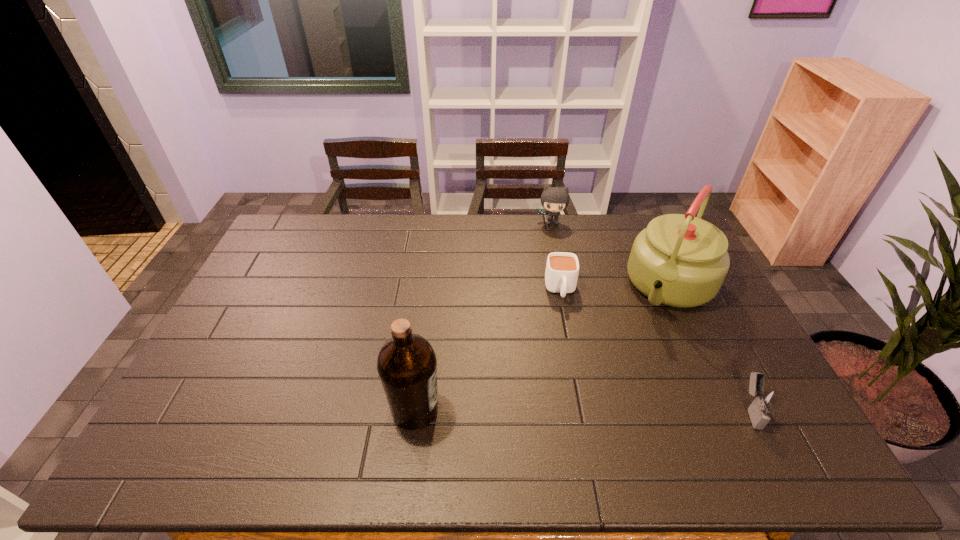
I want to click on vacant space situated on the side with the handle of the shortest object, so click(x=566, y=338).

The height and width of the screenshot is (540, 960). What are the coordinates of `blank area located at the spout of the kettle` in the screenshot? It's located at (651, 328).

This screenshot has width=960, height=540. Find the location of `vacant region located at the spout of the kettle`. vacant region located at the spout of the kettle is located at coordinates (x=614, y=390).

Identify the location of vacant space located at the spout of the kettle. click(x=636, y=354).

Identify the location of free space located on the front-facing side of the kitten. The height and width of the screenshot is (540, 960). (550, 247).

Where is `free space located 0.080m on the front-facing side of the kitten`? Image resolution: width=960 pixels, height=540 pixels. free space located 0.080m on the front-facing side of the kitten is located at coordinates (550, 240).

Image resolution: width=960 pixels, height=540 pixels. What are the coordinates of `vacant space located 0.350m on the front-facing side of the kitten` in the screenshot? It's located at (548, 290).

This screenshot has height=540, width=960. Find the location of `object that is positioned at the far edge`. object that is positioned at the far edge is located at coordinates (554, 199).

Locate an element on the screen. olive oil present at the near edge is located at coordinates (407, 365).

The height and width of the screenshot is (540, 960). I want to click on igniter located at the near edge, so click(x=765, y=400).